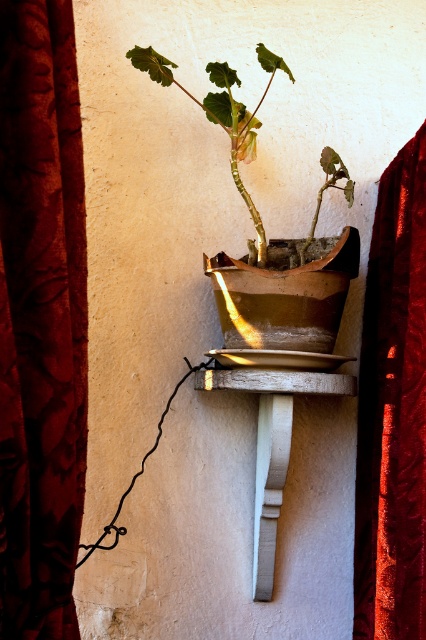
Does velvet dark red curtain at left have a smaller size compared to velvet red curtain at right?

Yes.

Is the position of velvet dark red curtain at left less distant than that of velvet red curtain at right?

Yes.

The width and height of the screenshot is (426, 640). Find the location of `velvet dark red curtain at left`. velvet dark red curtain at left is located at coordinates (40, 320).

Locate an element on the screen. velvet dark red curtain at left is located at coordinates (40, 320).

Locate an element on the screen. This screenshot has width=426, height=640. velvet dark red curtain at left is located at coordinates (40, 320).

Can you confirm if velvet dark red curtain at left is bigger than white painted wood at center?

Yes, velvet dark red curtain at left is bigger than white painted wood at center.

In order to click on velvet dark red curtain at left in this screenshot , I will do `click(40, 320)`.

Does velvet dark red curtain at left have a greater height compared to matte brown pot at center?

Yes, velvet dark red curtain at left is taller than matte brown pot at center.

Who is lower down, velvet dark red curtain at left or matte brown pot at center?

velvet dark red curtain at left is lower down.

This screenshot has height=640, width=426. What are the coordinates of `velvet dark red curtain at left` in the screenshot? It's located at pyautogui.click(x=40, y=320).

I want to click on velvet dark red curtain at left, so click(x=40, y=320).